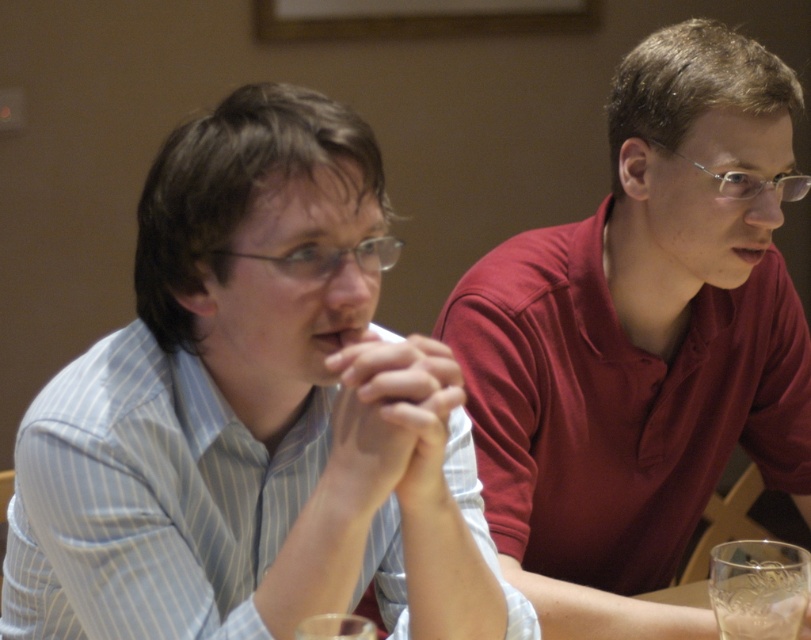
Question: Can you confirm if matte red shirt at center is positioned above transparent glass at lower right?

Choices:
 (A) no
 (B) yes

Answer: (B)

Question: Does matte red shirt at center have a greater width compared to transparent glass at lower right?

Choices:
 (A) yes
 (B) no

Answer: (A)

Question: Among these objects, which one is nearest to the camera?

Choices:
 (A) matte red shirt at center
 (B) transparent glass at lower right

Answer: (B)

Question: Does matte red shirt at center have a lesser width compared to transparent glass at lower right?

Choices:
 (A) no
 (B) yes

Answer: (A)

Question: Which point appears farthest from the camera in this image?

Choices:
 (A) tap(769, 120)
 (B) tap(721, 572)

Answer: (A)

Question: Among these points, which one is nearest to the camera?

Choices:
 (A) (749, 570)
 (B) (625, 442)

Answer: (A)